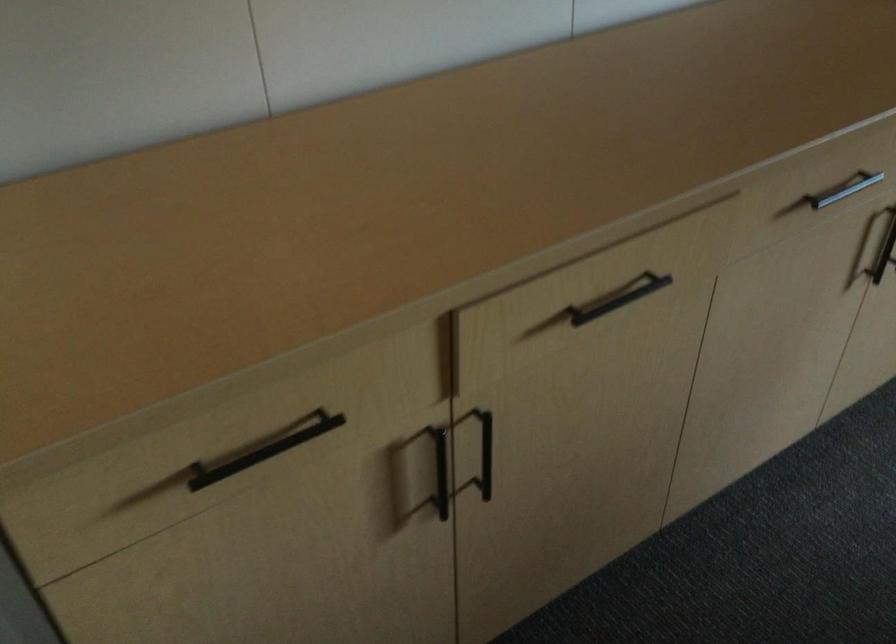
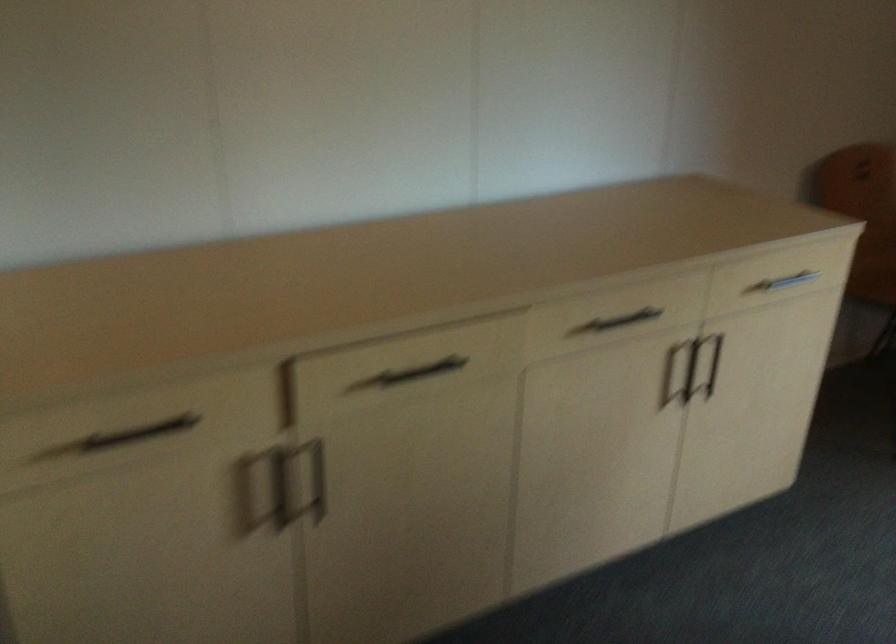
What movement of the cameraman would produce the second image?

The cameraman walked toward right, backward.